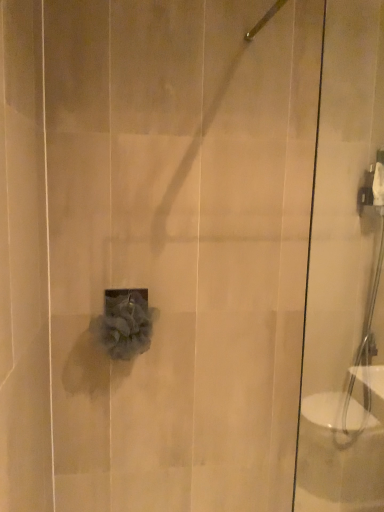
Question: From the image's perspective, would you say transparent glass shower door at right is positioned over satin nickel showerhead at upper center?

Choices:
 (A) no
 (B) yes

Answer: (A)

Question: Can you see transparent glass shower door at right touching satin nickel showerhead at upper center?

Choices:
 (A) yes
 (B) no

Answer: (B)

Question: Can you confirm if transparent glass shower door at right is bigger than satin nickel showerhead at upper center?

Choices:
 (A) yes
 (B) no

Answer: (A)

Question: Is transparent glass shower door at right positioned with its back to satin nickel showerhead at upper center?

Choices:
 (A) no
 (B) yes

Answer: (A)

Question: Can satin nickel showerhead at upper center be found inside transparent glass shower door at right?

Choices:
 (A) no
 (B) yes

Answer: (A)

Question: Would you say transparent glass shower door at right is to the left or to the right of satin nickel showerhead at upper center in the picture?

Choices:
 (A) right
 (B) left

Answer: (A)

Question: Do you think transparent glass shower door at right is within satin nickel showerhead at upper center, or outside of it?

Choices:
 (A) inside
 (B) outside

Answer: (B)

Question: Is transparent glass shower door at right bigger or smaller than satin nickel showerhead at upper center?

Choices:
 (A) small
 (B) big

Answer: (B)

Question: Is point (334, 242) closer or farther from the camera than point (244, 39)?

Choices:
 (A) farther
 (B) closer

Answer: (A)

Question: In terms of size, does satin nickel showerhead at upper center appear bigger or smaller than gray fluffy loofah at center?

Choices:
 (A) small
 (B) big

Answer: (A)

Question: In the image, is satin nickel showerhead at upper center positioned in front of or behind gray fluffy loofah at center?

Choices:
 (A) behind
 (B) front

Answer: (B)

Question: In terms of width, does satin nickel showerhead at upper center look wider or thinner when compared to gray fluffy loofah at center?

Choices:
 (A) wide
 (B) thin

Answer: (A)

Question: From the image's perspective, is satin nickel showerhead at upper center above or below gray fluffy loofah at center?

Choices:
 (A) below
 (B) above

Answer: (B)

Question: Choose the correct answer: Is satin nickel showerhead at upper center inside transparent glass shower door at right or outside it?

Choices:
 (A) inside
 (B) outside

Answer: (B)

Question: In terms of width, does satin nickel showerhead at upper center look wider or thinner when compared to transparent glass shower door at right?

Choices:
 (A) wide
 (B) thin

Answer: (A)